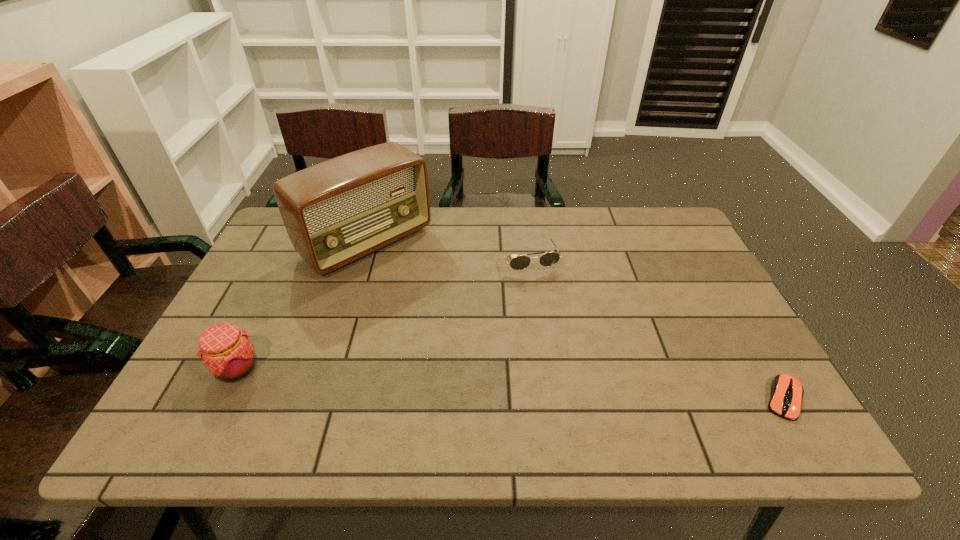
At what (x,y) coordinates should I click in order to perform the action: click on vacant space on the desktop that is between the jam and the rightmost object and is positioned on the front-facing side of the radio receiver. Please return your answer as a coordinate pair (x, y). Looking at the image, I should click on (525, 384).

Identify the location of free space on the desktop that is between the jam and the rightmost object and is positioned on the front lenses of the sunglasses. (581, 387).